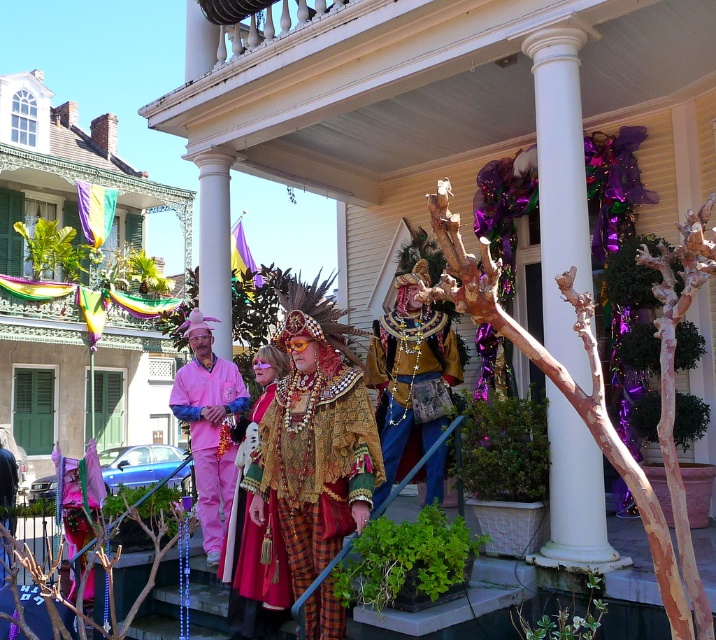
You are a photographer standing at the bottom of the steps. You want to take a photo of both the gold sequined costume at center and the matte pink costume at center without moving either. Is there enough space between them for you to capture both in a single frame?

The distance between the gold sequened costume at center and the matte pink costume at center is 59.69 centimeters. Since the photographer can adjust the camera angle and zoom, it is possible to capture both in a single frame as the distance is manageable for a standard camera lens.

You are standing at the bottom of the steps on the porch and want to reach the gold sequined costume at center. The steps are decorated with streamers that are 1.5 feet wide. How many streamers do you need to step over to reach the costume?

The gold sequined costume at center is 18.11 feet away from you. Since each streamer is 1.5 feet wide, you would need to step over approximately 12 streamers to reach the costume.

You are standing on the porch and want to take a photo of the gold sequined costume at center. Which direction should you face to ensure it is in the center of your camera view?

The gold sequined costume at center is already positioned at the center of the image, so facing directly ahead will keep it centered in your camera view.